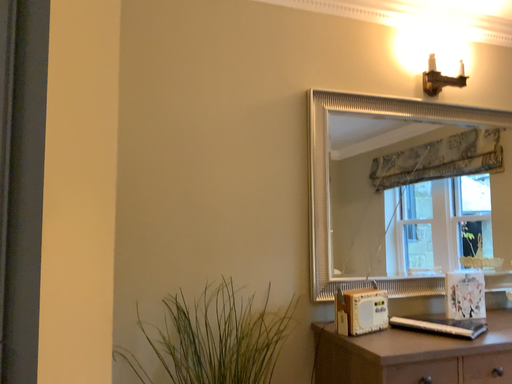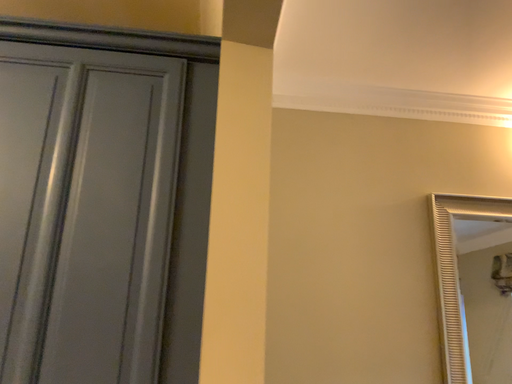
Question: Which way did the camera rotate in the video?

Choices:
 (A) rotated upward
 (B) rotated downward

Answer: (A)